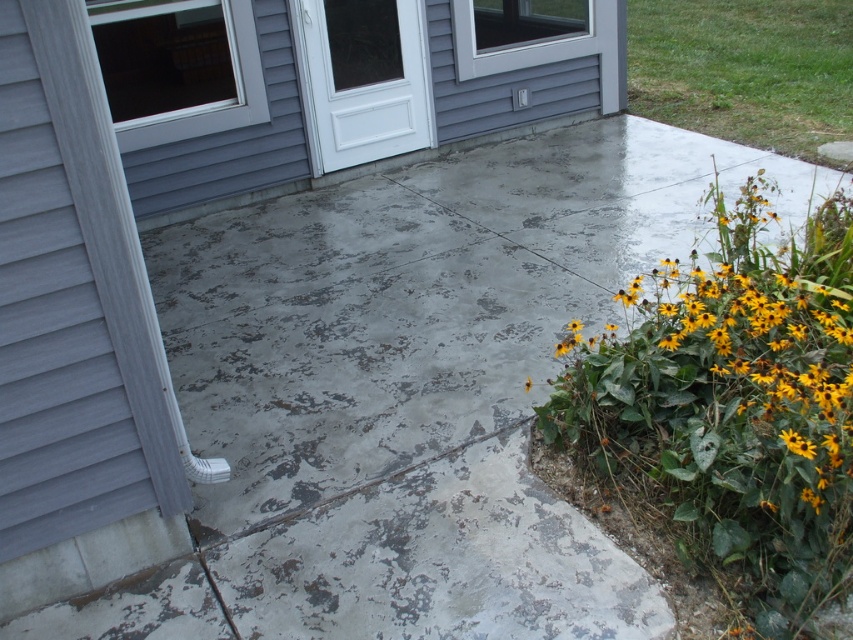
You are standing at point (346, 84) in the residential outdoor area. What is the material of the surface you are currently standing on?

The surface at point (346, 84) is gray concrete terrace at upper center.